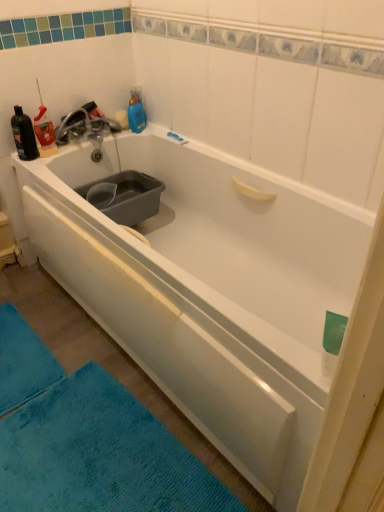
Question: Are black matte bottle at upper left and matte silver faucet at upper left far apart?

Choices:
 (A) yes
 (B) no

Answer: (B)

Question: Considering the relative positions of black matte bottle at upper left and matte silver faucet at upper left in the image provided, is black matte bottle at upper left in front of matte silver faucet at upper left?

Choices:
 (A) yes
 (B) no

Answer: (A)

Question: Does black matte bottle at upper left appear on the left side of matte silver faucet at upper left?

Choices:
 (A) no
 (B) yes

Answer: (B)

Question: From a real-world perspective, is black matte bottle at upper left physically below matte silver faucet at upper left?

Choices:
 (A) no
 (B) yes

Answer: (A)

Question: Is black matte bottle at upper left behind matte silver faucet at upper left?

Choices:
 (A) yes
 (B) no

Answer: (B)

Question: Is black matte bottle at upper left not within matte silver faucet at upper left?

Choices:
 (A) no
 (B) yes

Answer: (B)

Question: Can you confirm if matte silver faucet at upper left is wider than black matte bottle at upper left?

Choices:
 (A) yes
 (B) no

Answer: (A)

Question: Can black matte bottle at upper left be found inside matte silver faucet at upper left?

Choices:
 (A) yes
 (B) no

Answer: (B)

Question: Considering the relative positions of matte silver faucet at upper left and black matte bottle at upper left in the image provided, is matte silver faucet at upper left to the right of black matte bottle at upper left from the viewer's perspective?

Choices:
 (A) yes
 (B) no

Answer: (A)

Question: Can you confirm if matte silver faucet at upper left is bigger than black matte bottle at upper left?

Choices:
 (A) yes
 (B) no

Answer: (A)

Question: Considering the relative positions of matte silver faucet at upper left and black matte bottle at upper left in the image provided, is matte silver faucet at upper left to the left of black matte bottle at upper left from the viewer's perspective?

Choices:
 (A) yes
 (B) no

Answer: (B)

Question: Does matte silver faucet at upper left touch black matte bottle at upper left?

Choices:
 (A) yes
 (B) no

Answer: (B)

Question: From the image's perspective, is blue soft bath mat at lower left above matte silver faucet at upper left?

Choices:
 (A) yes
 (B) no

Answer: (B)